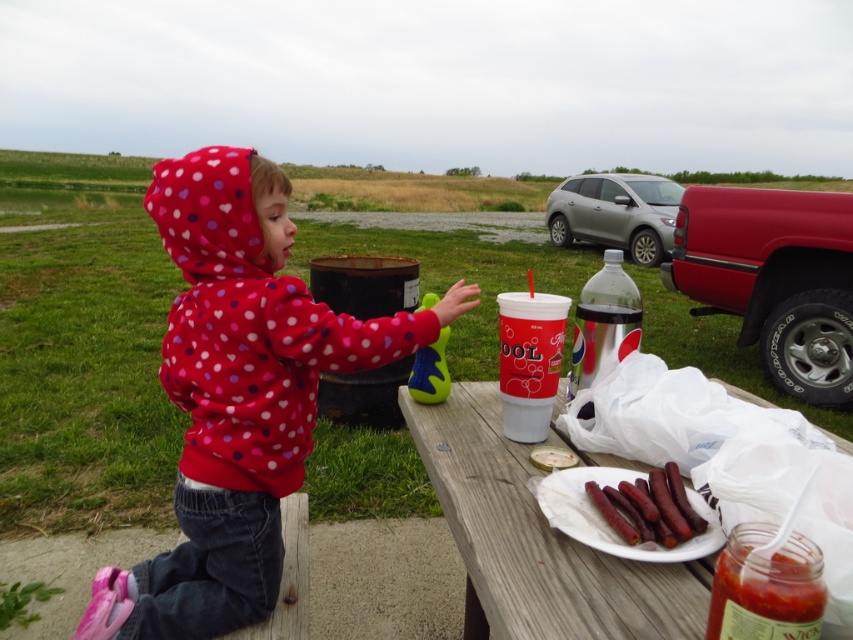
This screenshot has width=853, height=640. What are the coordinates of `polka dot fleece hoodie at center` in the screenshot? It's located at point(238,396).

Locate an element on the screen. polka dot fleece hoodie at center is located at coordinates (238, 396).

This screenshot has width=853, height=640. What are the coordinates of `polka dot fleece hoodie at center` in the screenshot? It's located at (238, 396).

Image resolution: width=853 pixels, height=640 pixels. What do you see at coordinates (604, 323) in the screenshot? I see `clear plastic bottle at center` at bounding box center [604, 323].

In the scene shown: Does clear plastic bottle at center have a larger size compared to brown textured hot dogs at lower right?

Yes.

Is point (631, 282) less distant than point (631, 497)?

No, (631, 282) is behind (631, 497).

Identify the location of clear plastic bottle at center. (604, 323).

Based on the photo, who is shorter, polka dot fleece hoodie at center or wooden picnic table at lower center?

wooden picnic table at lower center

Can you confirm if polka dot fleece hoodie at center is smaller than wooden picnic table at lower center?

No, polka dot fleece hoodie at center is not smaller than wooden picnic table at lower center.

Which is behind, point (173, 250) or point (483, 522)?

Positioned behind is point (173, 250).

You are a GUI agent. You are given a task and a screenshot of the screen. Output one action in this format:
    pyautogui.click(x=<x>, y=<y>)
    Task: Click on the polka dot fleece hoodie at center
    
    Given the screenshot: What is the action you would take?
    pyautogui.click(x=238, y=396)